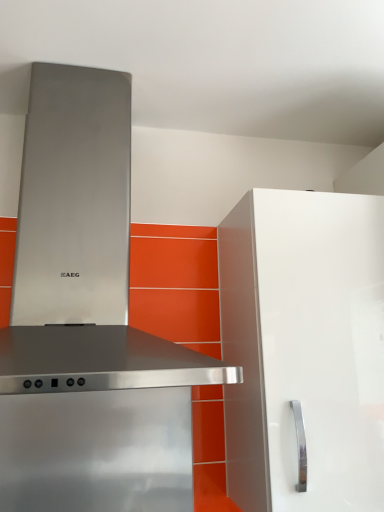
Locate an element on the screen. This screenshot has height=512, width=384. free space above stainless steel range hood at upper left (from a real-world perspective) is located at coordinates (94, 48).